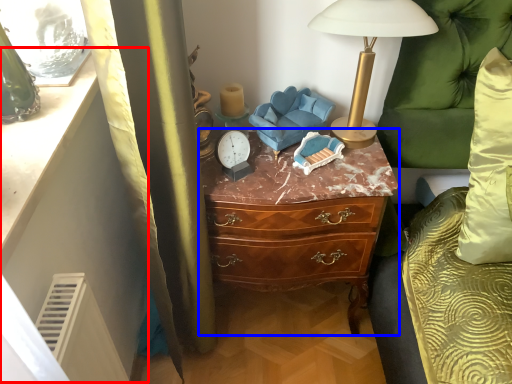
Question: Which of the following is the closest to the observer, vanity (highlighted by a red box) or chest of drawers (highlighted by a blue box)?

Choices:
 (A) vanity
 (B) chest of drawers

Answer: (A)